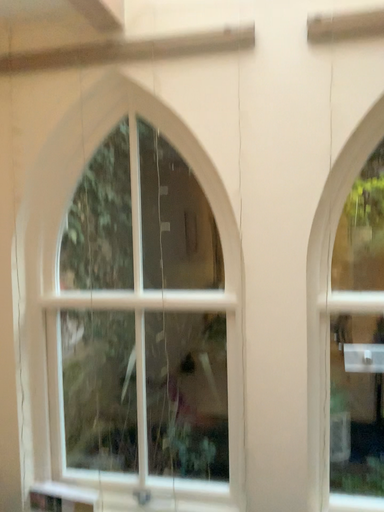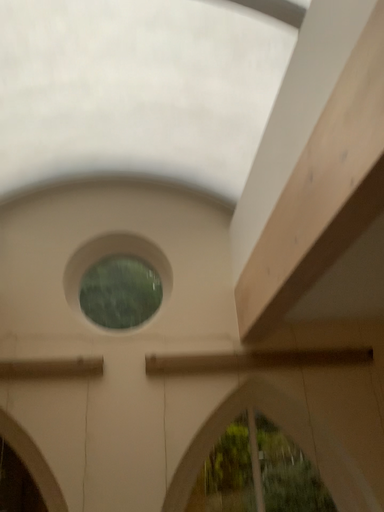
Question: Which way did the camera rotate in the video?

Choices:
 (A) rotated right
 (B) rotated left

Answer: (A)